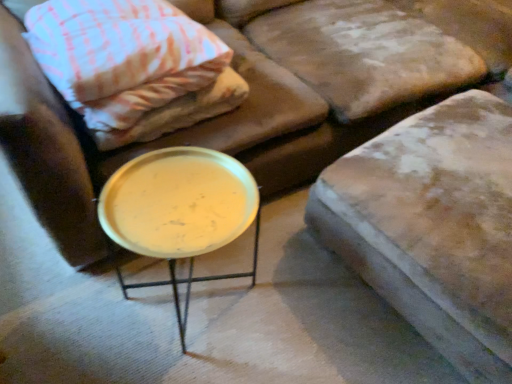
Question: From the image's perspective, does pink woven fabric pillow at upper left appear higher than metallic gold tray at center?

Choices:
 (A) no
 (B) yes

Answer: (B)

Question: From a real-world perspective, is pink woven fabric pillow at upper left located higher than metallic gold tray at center?

Choices:
 (A) no
 (B) yes

Answer: (B)

Question: Is pink woven fabric pillow at upper left at the left side of metallic gold tray at center?

Choices:
 (A) yes
 (B) no

Answer: (A)

Question: Are pink woven fabric pillow at upper left and metallic gold tray at center located far from each other?

Choices:
 (A) no
 (B) yes

Answer: (A)

Question: Can you confirm if pink woven fabric pillow at upper left is smaller than metallic gold tray at center?

Choices:
 (A) no
 (B) yes

Answer: (B)

Question: Does pink woven fabric pillow at upper left have a lesser height compared to metallic gold tray at center?

Choices:
 (A) yes
 (B) no

Answer: (A)

Question: Is leather cushion at upper right completely or partially inside metallic gold tray at center?

Choices:
 (A) no
 (B) yes

Answer: (A)

Question: Considering the relative positions of metallic gold tray at center and leather cushion at upper right in the image provided, is metallic gold tray at center behind leather cushion at upper right?

Choices:
 (A) no
 (B) yes

Answer: (B)

Question: Considering the relative positions of metallic gold tray at center and leather cushion at upper right in the image provided, is metallic gold tray at center in front of leather cushion at upper right?

Choices:
 (A) yes
 (B) no

Answer: (B)

Question: Is metallic gold tray at center positioned beyond the bounds of leather cushion at upper right?

Choices:
 (A) no
 (B) yes

Answer: (B)

Question: Can you confirm if metallic gold tray at center is wider than leather cushion at upper right?

Choices:
 (A) no
 (B) yes

Answer: (A)

Question: From a real-world perspective, is metallic gold tray at center physically above leather cushion at upper right?

Choices:
 (A) no
 (B) yes

Answer: (B)

Question: Is pink woven fabric pillow at upper left far from leather cushion at upper right?

Choices:
 (A) yes
 (B) no

Answer: (B)